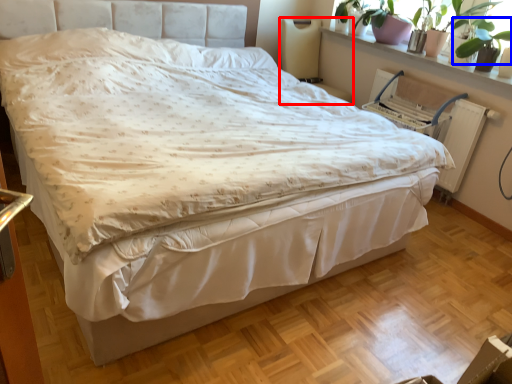
Question: Which object is further to the camera taking this photo, swivel chair (highlighted by a red box) or plant (highlighted by a blue box)?

Choices:
 (A) swivel chair
 (B) plant

Answer: (A)